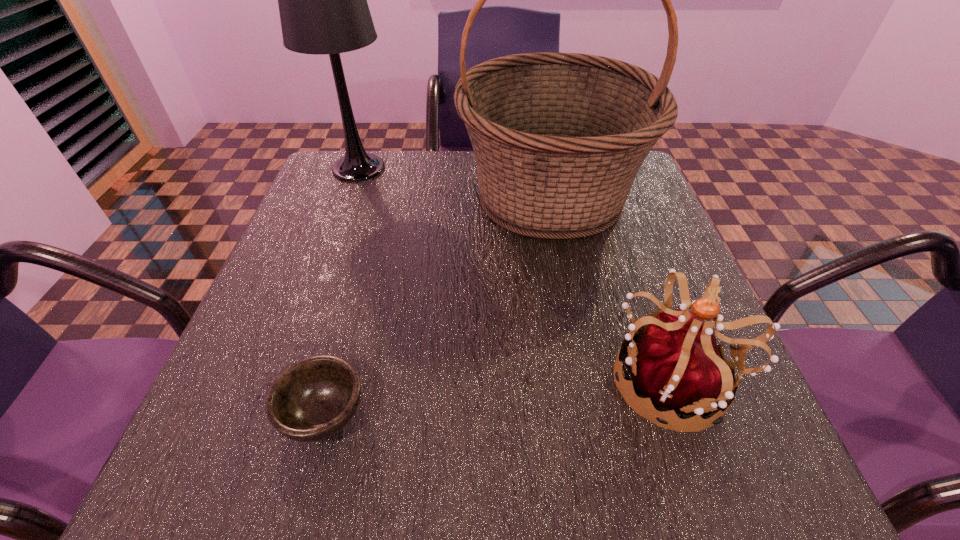
I want to click on basket present at the far edge, so click(x=558, y=138).

In order to click on table lamp at the far edge in this screenshot , I will do `click(322, 0)`.

Locate an element on the screen. This screenshot has height=540, width=960. tiara located at the near edge is located at coordinates (677, 364).

You are a GUI agent. You are given a task and a screenshot of the screen. Output one action in this format:
    pyautogui.click(x=<x>, y=<y>)
    Task: Click on the bowl located in the near edge section of the desktop
    
    Given the screenshot: What is the action you would take?
    pyautogui.click(x=314, y=398)

The image size is (960, 540). I want to click on table lamp that is at the left edge, so click(x=322, y=0).

Find the location of a particular element. This screenshot has height=540, width=960. bowl positioned at the left edge is located at coordinates (314, 398).

At what (x,y) coordinates should I click in order to perform the action: click on basket that is at the right edge. Please return your answer as a coordinate pair (x, y). This screenshot has width=960, height=540. Looking at the image, I should click on (558, 138).

At what (x,y) coordinates should I click in order to perform the action: click on tiara that is at the right edge. Please return your answer as a coordinate pair (x, y). This screenshot has width=960, height=540. Looking at the image, I should click on (677, 364).

Locate an element on the screen. object situated at the far left corner is located at coordinates (322, 0).

Image resolution: width=960 pixels, height=540 pixels. Find the location of `object at the near left corner`. object at the near left corner is located at coordinates (314, 398).